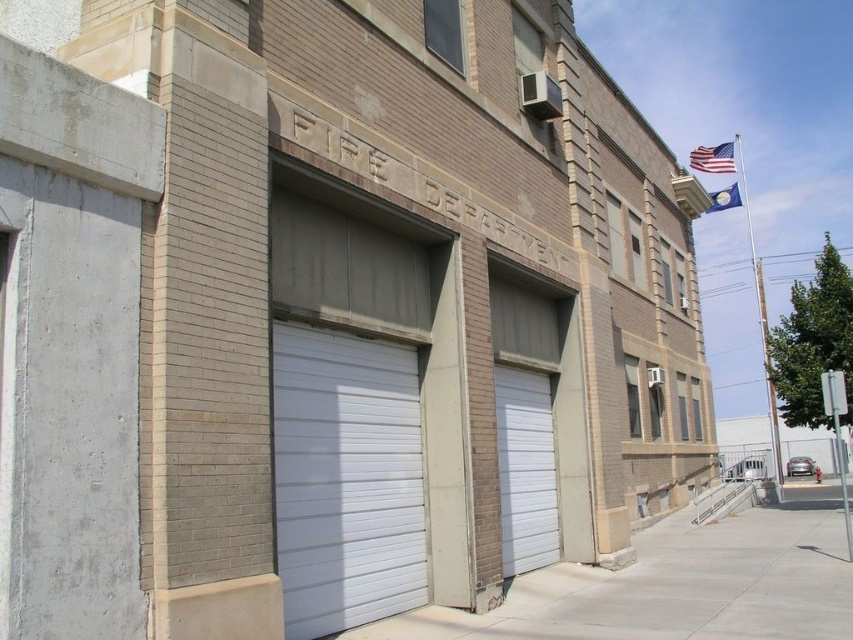
Is american flag at upper right bigger than blue fabric flag at upper right?

Indeed, american flag at upper right has a larger size compared to blue fabric flag at upper right.

Does american flag at upper right have a lesser height compared to blue fabric flag at upper right?

Incorrect, american flag at upper right's height does not fall short of blue fabric flag at upper right's.

Is point (727, 160) farther from camera compared to point (717, 196)?

Yes, point (727, 160) is behind point (717, 196).

Identify the location of american flag at upper right. The height and width of the screenshot is (640, 853). (712, 157).

Is white metallic garage door at center closer to the viewer compared to white smooth garage door at center?

That is True.

Based on the photo, how far apart are white metallic garage door at center and white smooth garage door at center?

white metallic garage door at center and white smooth garage door at center are 3.06 meters apart from each other.

You are a GUI agent. You are given a task and a screenshot of the screen. Output one action in this format:
    pyautogui.click(x=<x>, y=<y>)
    Task: Click on the white metallic garage door at center
    The image size is (853, 640).
    Given the screenshot: What is the action you would take?
    345,477

Identify the location of white metallic garage door at center. (345, 477).

Locate an element on the screen. The height and width of the screenshot is (640, 853). white smooth garage door at center is located at coordinates (525, 468).

Measure the distance from white smooth garage door at center to american flag at upper right.

white smooth garage door at center is 80.59 feet from american flag at upper right.

Who is more forward, (548, 451) or (704, 168)?

Point (548, 451)

Locate an element on the screen. The image size is (853, 640). white smooth garage door at center is located at coordinates click(x=525, y=468).